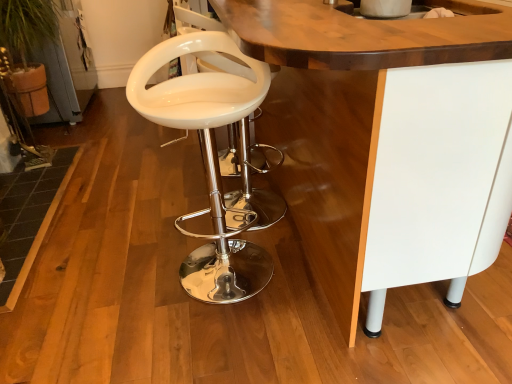
Locate an element on the screen. free space in front of white glossy bar stool at center is located at coordinates (227, 334).